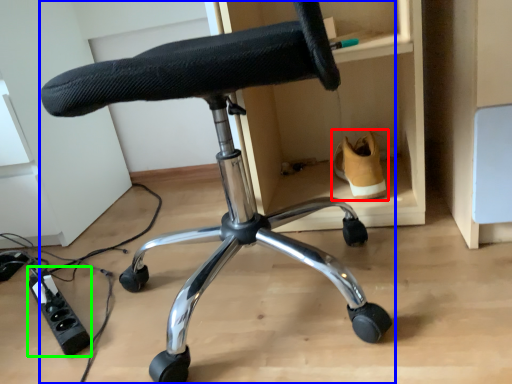
Question: Considering the real-world distances, which object is closest to footwear (highlighted by a red box)? chair (highlighted by a blue box) or plug (highlighted by a green box).

Choices:
 (A) chair
 (B) plug

Answer: (A)